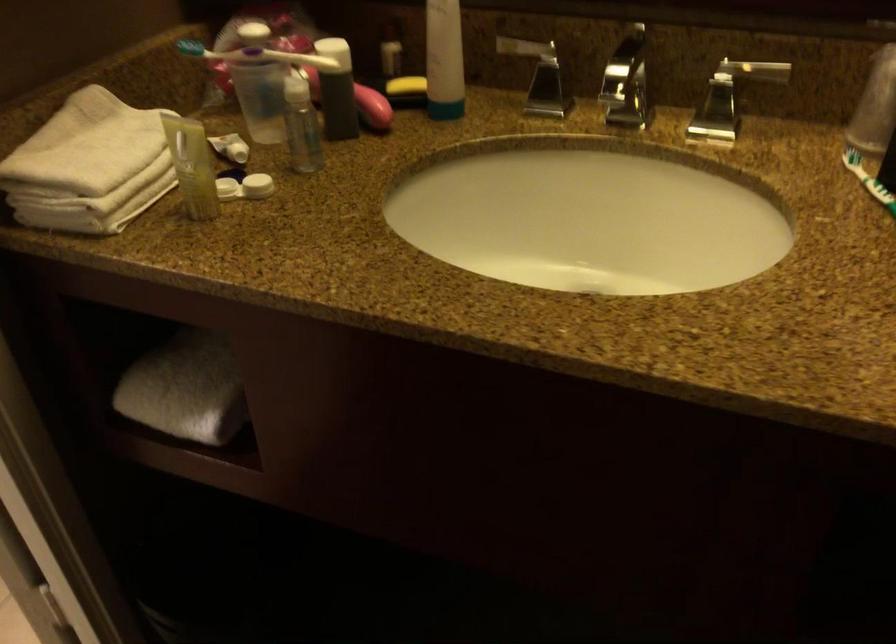
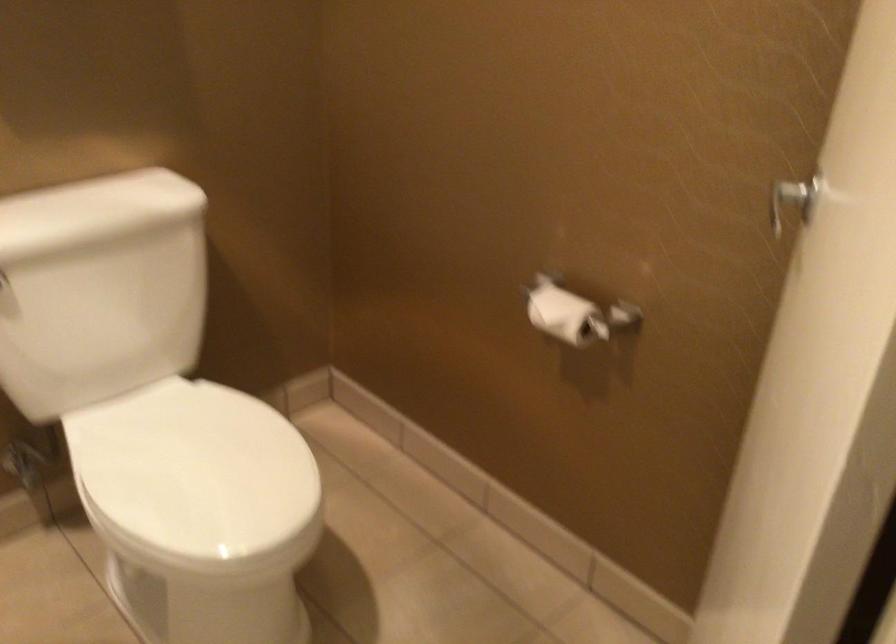
Question: The images are taken continuously from a first-person perspective. In which direction is your viewpoint rotating?

Choices:
 (A) Left
 (B) Right
 (C) Up
 (D) Down

Answer: (A)